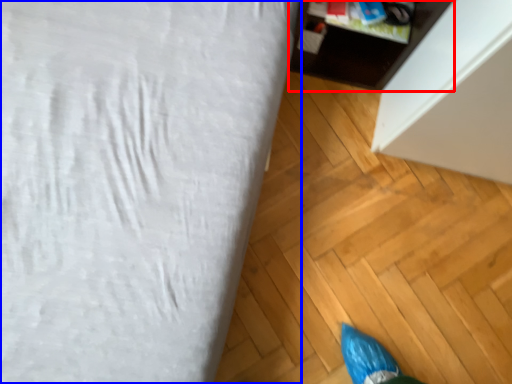
Question: Which point is further to the camera, furniture (highlighted by a red box) or furniture (highlighted by a blue box)?

Choices:
 (A) furniture
 (B) furniture

Answer: (A)